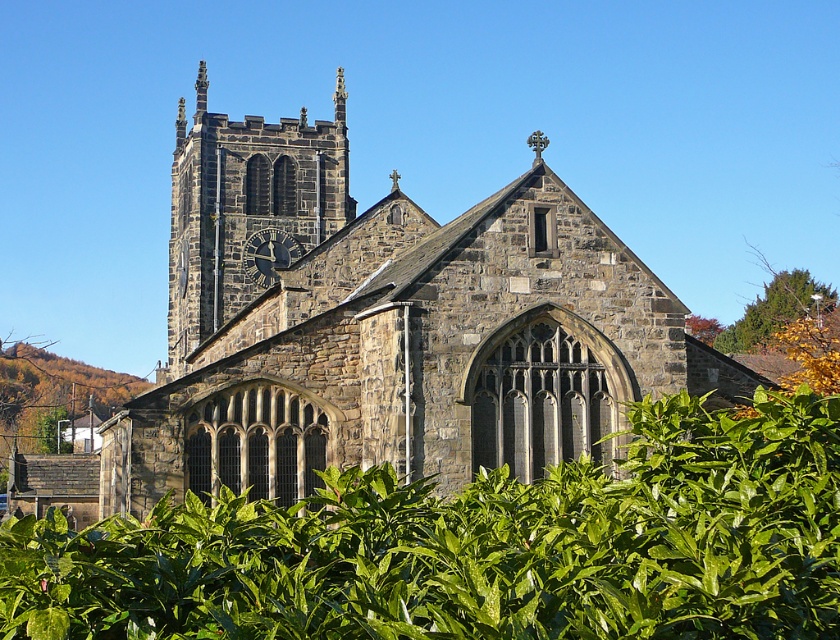
Looking at this image, does stone church at center come in front of dark gray stone clock tower at upper left?

Yes.

Can you confirm if stone church at center is wider than dark gray stone clock tower at upper left?

Correct, the width of stone church at center exceeds that of dark gray stone clock tower at upper left.

Locate an element on the screen. The height and width of the screenshot is (640, 840). stone church at center is located at coordinates [x=387, y=326].

Does dark gray stone clock tower at upper left have a lesser width compared to dark gray stone clock at center-left?

No, dark gray stone clock tower at upper left is not thinner than dark gray stone clock at center-left.

This screenshot has width=840, height=640. Describe the element at coordinates (245, 209) in the screenshot. I see `dark gray stone clock tower at upper left` at that location.

Identify the location of dark gray stone clock tower at upper left. point(245,209).

Which is more to the right, stone church at center or dark gray stone clock at center-left?

stone church at center

Can you confirm if stone church at center is taller than dark gray stone clock at center-left?

Yes, stone church at center is taller than dark gray stone clock at center-left.

Does point (736, 374) come behind point (273, 262)?

No, it is in front of (273, 262).

Find the location of `stone church at center`. stone church at center is located at coordinates (387, 326).